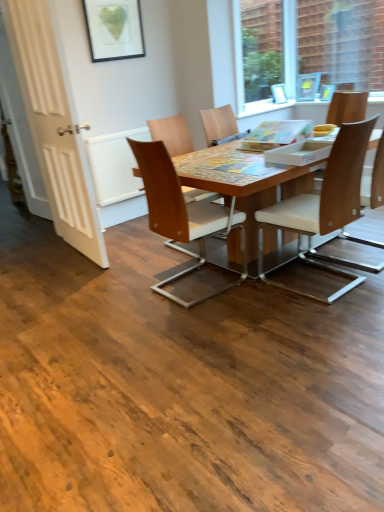
Question: Is light brown wood chair at right, the 2th chair in the right-to-left sequence, beside transparent glass window at upper right?

Choices:
 (A) yes
 (B) no

Answer: (B)

Question: Is light brown wood chair at right, acting as the fourth chair starting from the left, to the left of transparent glass window at upper right from the viewer's perspective?

Choices:
 (A) yes
 (B) no

Answer: (A)

Question: Does light brown wood chair at right, acting as the fourth chair starting from the left, come in front of transparent glass window at upper right?

Choices:
 (A) no
 (B) yes

Answer: (B)

Question: From a real-world perspective, is light brown wood chair at right, the 2th chair in the right-to-left sequence, beneath transparent glass window at upper right?

Choices:
 (A) yes
 (B) no

Answer: (A)

Question: Is light brown wood chair at right, acting as the fourth chair starting from the left, not inside transparent glass window at upper right?

Choices:
 (A) no
 (B) yes

Answer: (B)

Question: In the image, is wooden chair at center, the 5th chair positioned from the right, on the left side or the right side of light brown wood chair at right, the fifth chair from the left?

Choices:
 (A) right
 (B) left

Answer: (B)

Question: From a real-world perspective, is wooden chair at center, the 5th chair positioned from the right, positioned above or below light brown wood chair at right, the fifth chair from the left?

Choices:
 (A) above
 (B) below

Answer: (B)

Question: In the image, is wooden chair at center, which is counted as the 1th chair, starting from the left, positioned in front of or behind light brown wood chair at right, the fifth chair from the left?

Choices:
 (A) behind
 (B) front

Answer: (B)

Question: Considering the positions of wooden chair at center, which is counted as the 1th chair, starting from the left, and light brown wood chair at right, the fifth chair from the left, in the image, is wooden chair at center, which is counted as the 1th chair, starting from the left, wider or thinner than light brown wood chair at right, the fifth chair from the left,?

Choices:
 (A) thin
 (B) wide

Answer: (B)

Question: From a real-world perspective, relative to transparent glass window at upper right, is wooden chair at center, the 5th chair positioned from the right, vertically above or below?

Choices:
 (A) above
 (B) below

Answer: (B)

Question: In terms of width, does wooden chair at center, which is counted as the 1th chair, starting from the left, look wider or thinner when compared to transparent glass window at upper right?

Choices:
 (A) thin
 (B) wide

Answer: (B)

Question: Is wooden chair at center, which is counted as the 1th chair, starting from the left, spatially inside transparent glass window at upper right, or outside of it?

Choices:
 (A) outside
 (B) inside

Answer: (A)

Question: Does point (195, 208) appear closer or farther from the camera than point (276, 35)?

Choices:
 (A) closer
 (B) farther

Answer: (A)

Question: From a real-world perspective, is light brown wood chair at right, acting as the fourth chair starting from the left, above or below transparent glass window at upper right?

Choices:
 (A) above
 (B) below

Answer: (B)

Question: Would you say light brown wood chair at right, acting as the fourth chair starting from the left, is inside or outside transparent glass window at upper right?

Choices:
 (A) inside
 (B) outside

Answer: (B)